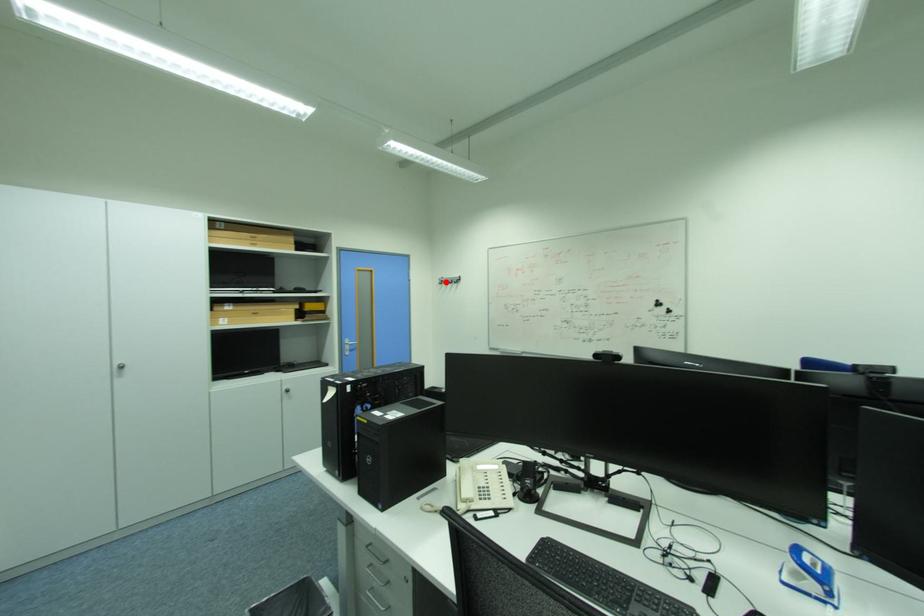
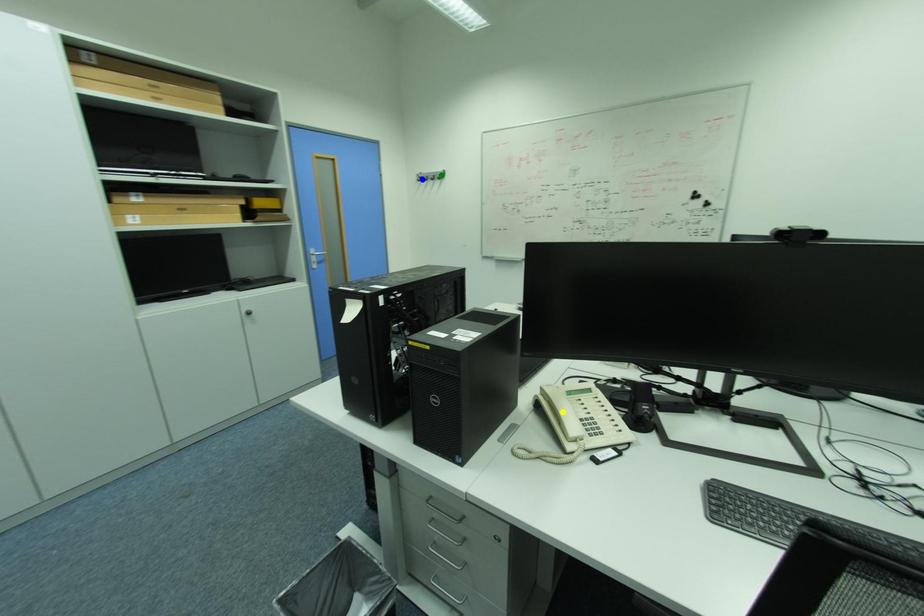
Question: I am providing you with two images of the same scene from different viewpoints. A red point is marked on the first image. You are given multiple points on the second image. Which point in image 2 represents the same 3d spot as the red point in image 1?

Choices:
 (A) green point
 (B) blue point
 (C) yellow point

Answer: (B)